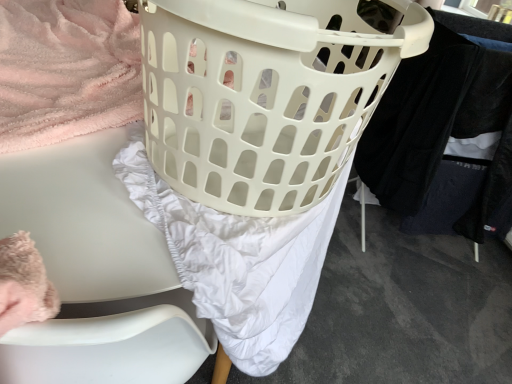
Question: Looking at their shapes, would you say white plastic chair at left is wider or thinner than white plastic laundry basket at center?

Choices:
 (A) wide
 (B) thin

Answer: (B)

Question: Is white plastic chair at left in front of or behind white plastic laundry basket at center in the image?

Choices:
 (A) behind
 (B) front

Answer: (B)

Question: Which object is the closest to the black cotton pants at right?

Choices:
 (A) white plastic laundry basket at center
 (B) white plastic chair at left

Answer: (A)

Question: Which is nearer to the white plastic chair at left?

Choices:
 (A) white plastic laundry basket at center
 (B) black cotton pants at right

Answer: (A)